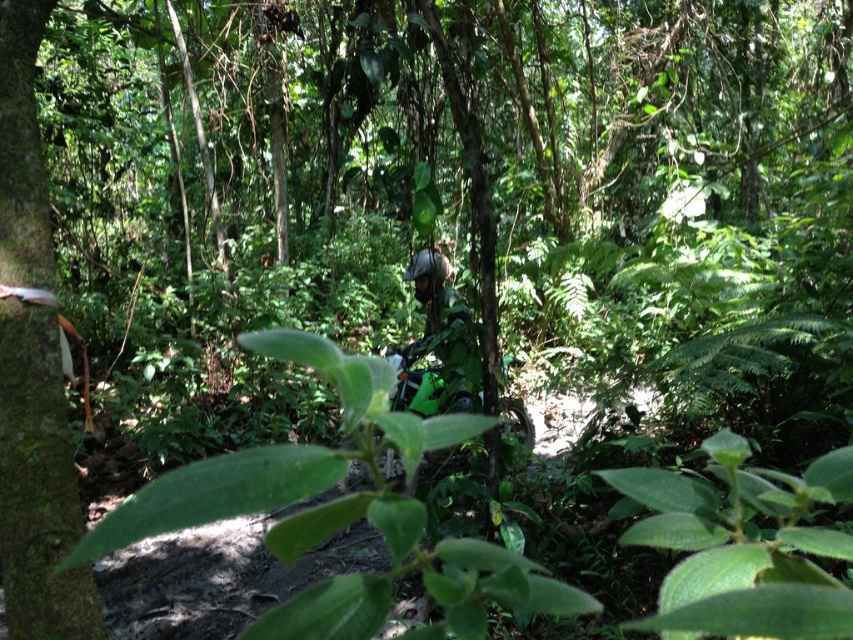
In the scene shown: Is green mossy tree trunk at left wider than green matte motorcycle at center?

Yes, green mossy tree trunk at left is wider than green matte motorcycle at center.

Describe the element at coordinates (38, 486) in the screenshot. I see `green mossy tree trunk at left` at that location.

Locate an element on the screen. This screenshot has height=640, width=853. green mossy tree trunk at left is located at coordinates (38, 486).

Where is `green mossy tree trunk at left`? This screenshot has width=853, height=640. green mossy tree trunk at left is located at coordinates (38, 486).